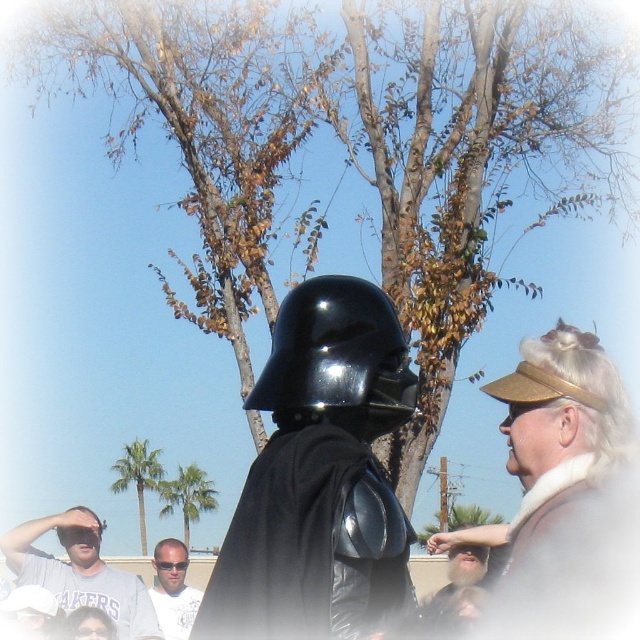
Question: Estimate the real-world distances between objects in this image. Which object is closer to the brown leather hat at upper right?

Choices:
 (A) beige fabric hat at lower right
 (B) black leather cape at center
 (C) glossy black helmet at center
 (D) gray cotton t-shirt at lower left

Answer: (A)

Question: Is brown leather hat at upper right further to the viewer compared to glossy black helmet at center?

Choices:
 (A) yes
 (B) no

Answer: (B)

Question: Does black leather cape at center appear under gray cotton t-shirt at lower left?

Choices:
 (A) yes
 (B) no

Answer: (B)

Question: Which point is closer to the camera taking this photo?

Choices:
 (A) (204, 595)
 (B) (317, 384)
 (C) (534, 621)
 (D) (438, 625)

Answer: (C)

Question: Among these objects, which one is farthest from the camera?

Choices:
 (A) light brown hair at center
 (B) beige fabric hat at lower right

Answer: (A)

Question: Can you confirm if glossy black helmet at center is thinner than gray cotton t-shirt at lower left?

Choices:
 (A) no
 (B) yes

Answer: (B)